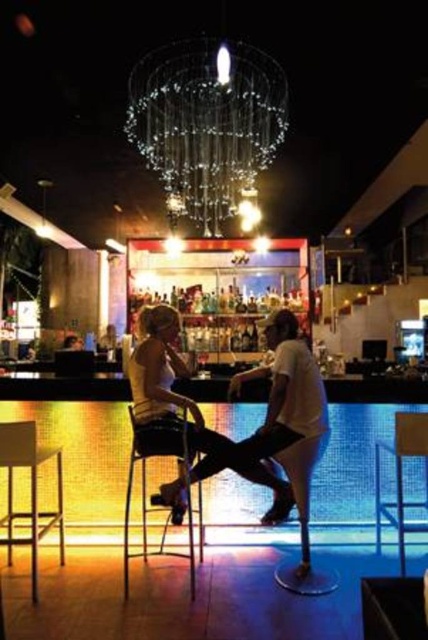
Which is in front, point (238, 144) or point (175, 413)?

Point (175, 413) is in front.

Who is positioned more to the right, clear glass chandelier at upper center or matte white shirt at center?

matte white shirt at center

Who is more distant from viewer, (157, 88) or (172, 445)?

Point (157, 88)

Find the location of a particular element. This screenshot has width=428, height=640. clear glass chandelier at upper center is located at coordinates [x=207, y=124].

How distant is matte white shirt at center from metallic silver bar stool at lower left?

A distance of 3.31 feet exists between matte white shirt at center and metallic silver bar stool at lower left.

Which is above, matte white shirt at center or metallic silver bar stool at lower left?

Positioned higher is matte white shirt at center.

Which is in front, point (178, 436) or point (35, 600)?

Point (35, 600) is more forward.

You are a GUI agent. You are given a task and a screenshot of the screen. Output one action in this format:
    pyautogui.click(x=<x>, y=<y>)
    Task: Click on the matte white shirt at center
    This screenshot has height=640, width=428.
    Given the screenshot: What is the action you would take?
    pyautogui.click(x=202, y=416)

Between clear glass chandelier at upper center and metallic silver stool at lower center, which one has more height?

metallic silver stool at lower center

Between point (269, 102) and point (409, 416), which one is positioned in front?

Positioned in front is point (409, 416).

Does point (237, 109) come behind point (401, 486)?

Yes, it is behind point (401, 486).

Find the location of a particular element. The width and height of the screenshot is (428, 640). clear glass chandelier at upper center is located at coordinates (207, 124).